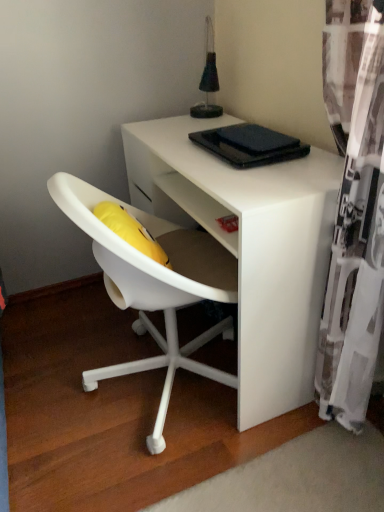
You are a GUI agent. You are given a task and a screenshot of the screen. Output one action in this format:
    pyautogui.click(x=<x>, y=<y>)
    Task: Click on the empty space that is ontop of white matte desk at center (from a real-world perspective)
    
    Given the screenshot: What is the action you would take?
    pyautogui.click(x=233, y=165)